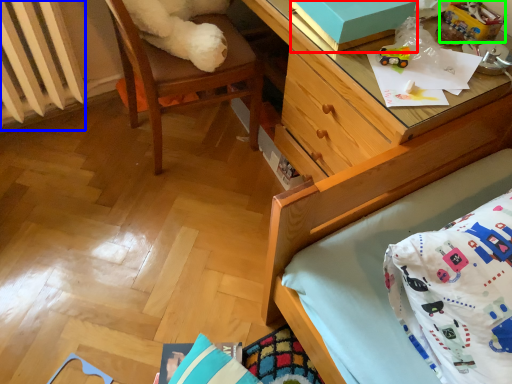
Question: Based on their relative distances, which object is farther from box (highlighted by a red box)? Choose from radiator (highlighted by a blue box) and toy (highlighted by a green box).

Choices:
 (A) radiator
 (B) toy

Answer: (A)